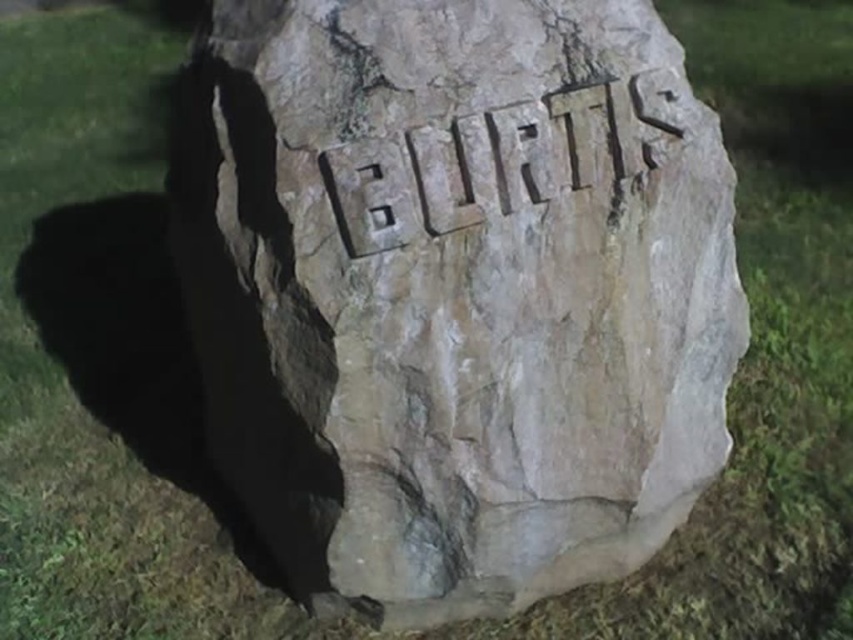
You are a geologist examining the brown rough stone at center and the carved stone name at center. Which object is located higher up on the rock?

The carved stone name at center is higher up on the rock than the brown rough stone at center.